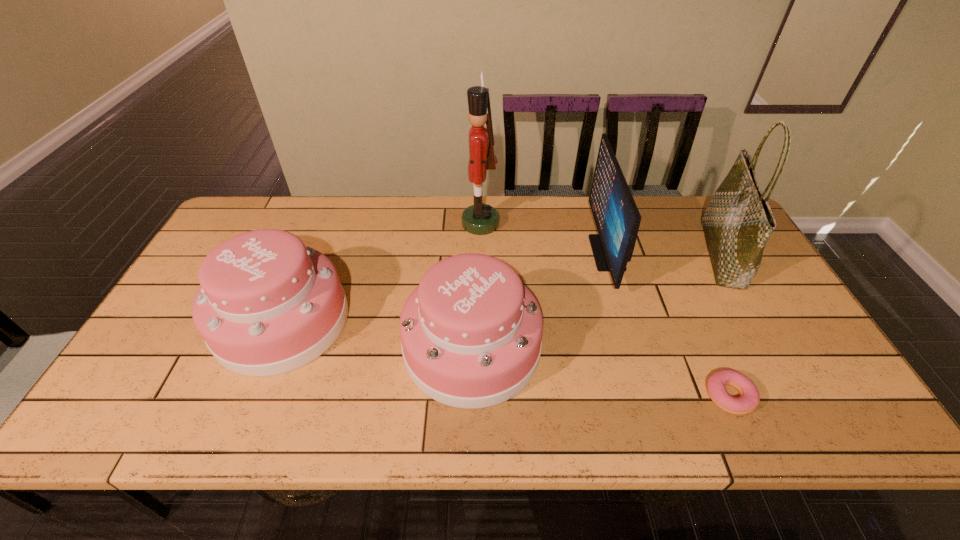
What are the coordinates of `computer monitor at the far edge` in the screenshot? It's located at (617, 218).

Image resolution: width=960 pixels, height=540 pixels. In order to click on cake located in the near edge section of the desktop in this screenshot , I will do `click(471, 333)`.

Find the location of a particular element. doughnut located in the near edge section of the desktop is located at coordinates (716, 385).

This screenshot has width=960, height=540. I want to click on object positioned at the left edge, so click(267, 305).

Where is `object that is at the right edge`? This screenshot has height=540, width=960. object that is at the right edge is located at coordinates (738, 221).

Find the location of a particular element. object present at the far right corner is located at coordinates (738, 221).

Identify the location of vacant space at the far edge. This screenshot has width=960, height=540. (371, 197).

At what (x,y) coordinates should I click in order to perform the action: click on vacant space at the near edge of the desktop. Please return your answer as a coordinate pair (x, y). The image size is (960, 540). Looking at the image, I should click on (394, 401).

You are a GUI agent. You are given a task and a screenshot of the screen. Output one action in this format:
    pyautogui.click(x=<x>, y=<y>)
    Task: Click on the vacant space at the right edge
    Image resolution: width=960 pixels, height=540 pixels.
    Given the screenshot: What is the action you would take?
    (x=725, y=306)

Identify the location of vacant space at the near left corner of the desktop. (133, 423).